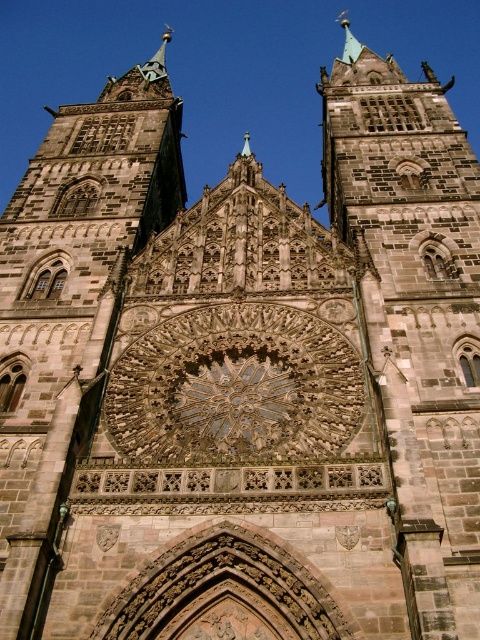
Is dark stone tower at center shorter than brown stone tower at center?

In fact, dark stone tower at center may be taller than brown stone tower at center.

Does point (424, 317) come behind point (75, 380)?

Yes, it is behind point (75, 380).

This screenshot has width=480, height=640. I want to click on dark stone tower at center, so click(x=415, y=314).